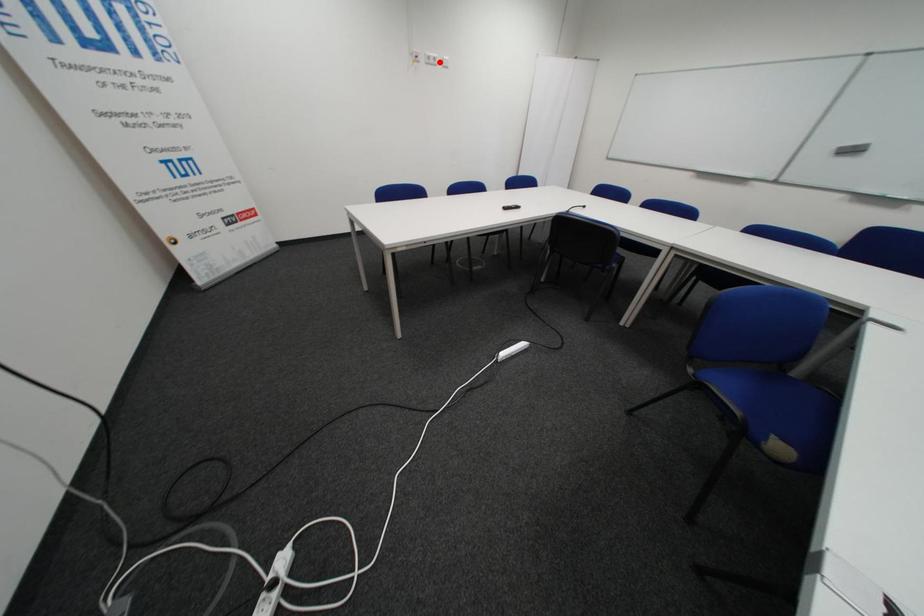
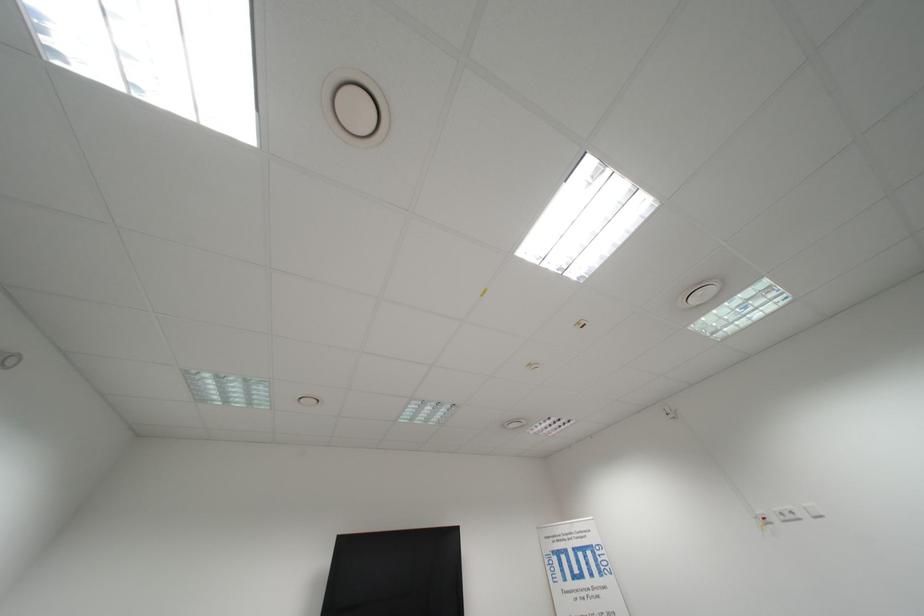
The point at the highlighted location is marked in the first image. Where is the corresponding point in the second image?

(796, 519)